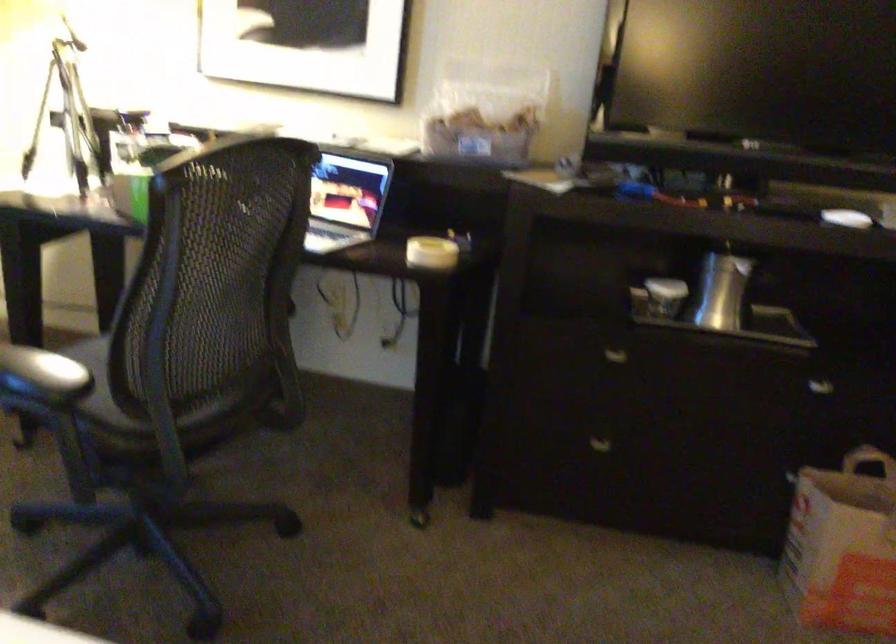
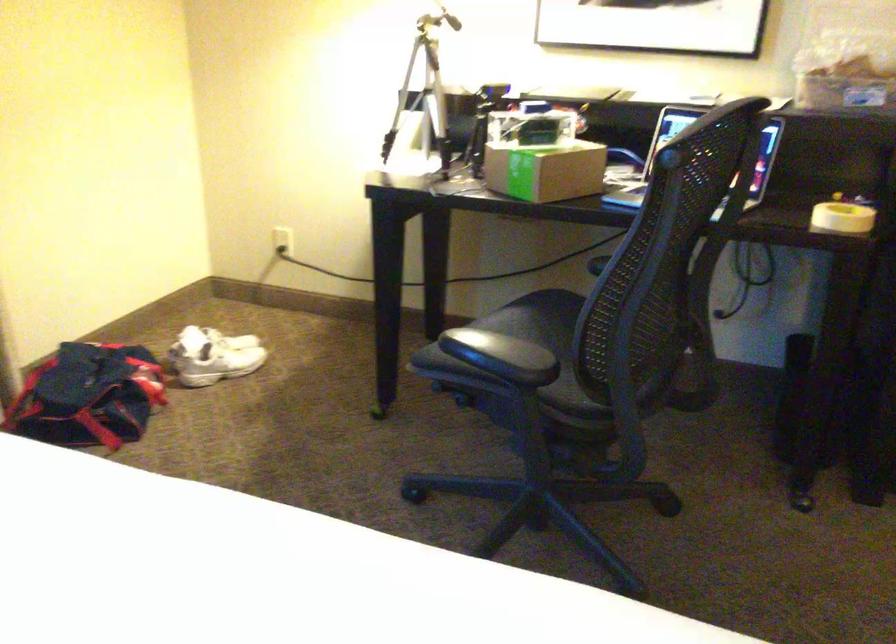
Find the pixel in the second image that matches point (424, 258) in the first image.

(841, 216)